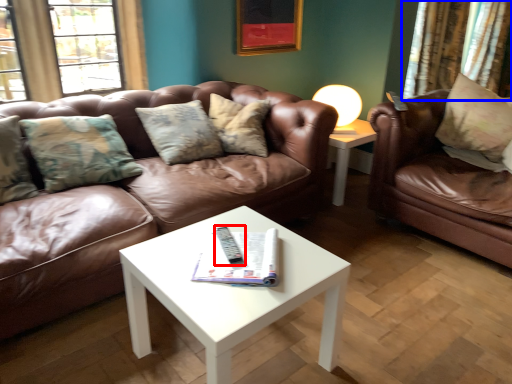
Question: Which object appears farthest to the camera in this image, remote (highlighted by a red box) or curtain (highlighted by a blue box)?

Choices:
 (A) remote
 (B) curtain

Answer: (B)